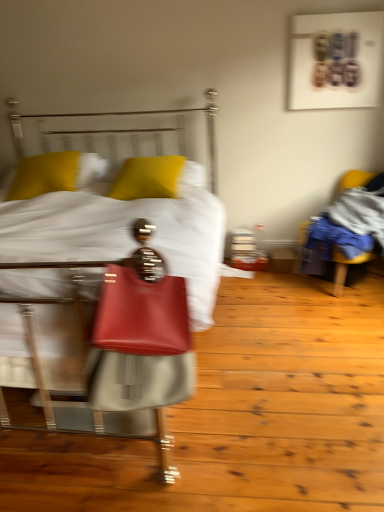
Question: Relative to yellow matte pillow at upper left, which appears as the 2th pillow when viewed from the right, is matte leather bed at center in front or behind?

Choices:
 (A) front
 (B) behind

Answer: (A)

Question: Based on their positions, is matte leather bed at center located to the left or right of yellow matte pillow at upper left, marked as the 1th pillow in a left-to-right arrangement?

Choices:
 (A) left
 (B) right

Answer: (B)

Question: Which object is positioned farthest from the matte red handbag at center?

Choices:
 (A) yellow fabric chair at right
 (B) yellow matte pillow at upper left, which appears as the 2th pillow when viewed from the right
 (C) matte leather bed at center
 (D) yellow matte pillow at center, the first pillow positioned from the right

Answer: (A)

Question: Estimate the real-world distances between objects in this image. Which object is farther from the matte leather bed at center?

Choices:
 (A) yellow matte pillow at upper left, marked as the 1th pillow in a left-to-right arrangement
 (B) matte red handbag at center
 (C) yellow matte pillow at center, the second pillow in the left-to-right sequence
 (D) yellow fabric chair at right

Answer: (D)